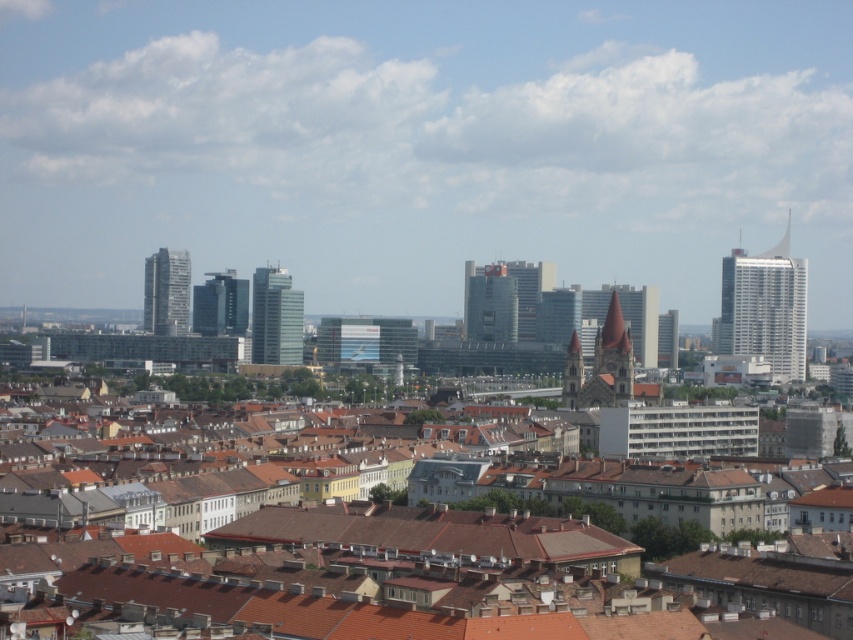
Can you confirm if glassy reflective skyscraper at center is shorter than matte glass building at center?

Incorrect, glassy reflective skyscraper at center's height does not fall short of matte glass building at center's.

Find the location of `glassy reflective skyscraper at center`. glassy reflective skyscraper at center is located at coordinates (276, 317).

Is point (146, 323) more distant than point (241, 285)?

Yes, it is.

Who is taller, translucent glass skyscraper at center-left or glassy reflective building at center?

translucent glass skyscraper at center-left is taller.

Find the location of `translucent glass skyscraper at center-left`. translucent glass skyscraper at center-left is located at coordinates (166, 292).

Is point (288, 339) positioned behind point (183, 310)?

No, (288, 339) is in front of (183, 310).

Who is positioned more to the right, glassy reflective skyscraper at center or translucent glass skyscraper at center-left?

glassy reflective skyscraper at center

Image resolution: width=853 pixels, height=640 pixels. Find the location of `glassy reflective skyscraper at center`. glassy reflective skyscraper at center is located at coordinates (276, 317).